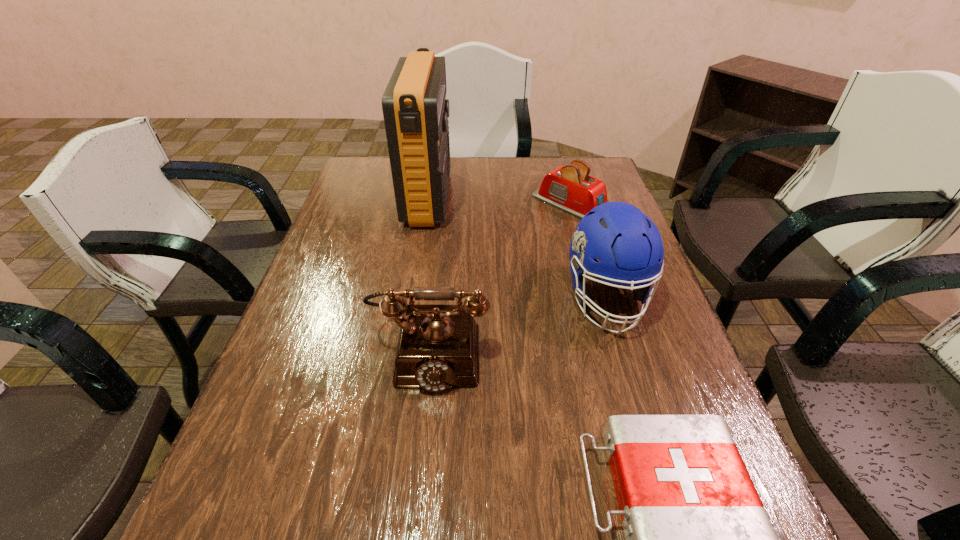
Where is `football helmet at the right edge`? This screenshot has width=960, height=540. football helmet at the right edge is located at coordinates (628, 244).

Identify the location of toaster that is at the right edge. The height and width of the screenshot is (540, 960). (570, 188).

This screenshot has height=540, width=960. I want to click on object that is positioned at the far right corner, so click(x=570, y=188).

You are a GUI agent. You are given a task and a screenshot of the screen. Output one action in this format:
    pyautogui.click(x=<x>, y=<y>)
    Task: Click on the free region at the far edge
    The height and width of the screenshot is (540, 960).
    Given the screenshot: What is the action you would take?
    [x=463, y=191]

Where is `blank area at the left edge`? blank area at the left edge is located at coordinates (314, 461).

Locate an element on the screen. vacant space at the right edge of the desktop is located at coordinates (652, 410).

Find the location of a particular element. Image resolution: width=960 pixels, height=540 pixels. vacant space at the far right corner of the desktop is located at coordinates (602, 168).

Locate an element on the screen. The height and width of the screenshot is (540, 960). empty space between the second tallest object and the telephone is located at coordinates (518, 324).

The height and width of the screenshot is (540, 960). Find the location of `unoccupied area between the fourth tallest object and the third shortest object`. unoccupied area between the fourth tallest object and the third shortest object is located at coordinates (500, 278).

Identify the location of unoccupied position between the football helmet and the tallest object. This screenshot has height=540, width=960. (517, 248).